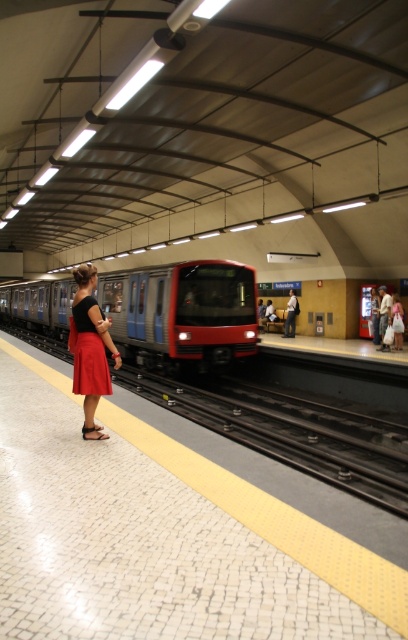
Question: Does white mosaic tile platform at center appear over matte red skirt at left?

Choices:
 (A) no
 (B) yes

Answer: (A)

Question: Considering the real-world distances, which object is farthest from the white mosaic tile platform at center?

Choices:
 (A) matte red skirt at center
 (B) matte red skirt at left

Answer: (B)

Question: Which object is closer to the camera taking this photo?

Choices:
 (A) matte red train at center
 (B) white mosaic tile platform at center
 (C) matte red skirt at left

Answer: (B)

Question: Can you confirm if white mosaic tile platform at center is wider than matte red skirt at left?

Choices:
 (A) no
 (B) yes

Answer: (B)

Question: Which point is farther to the camera?

Choices:
 (A) white mosaic tile platform at center
 (B) matte red train at center

Answer: (B)

Question: Is white mosaic tile platform at center positioned behind matte red skirt at left?

Choices:
 (A) yes
 (B) no

Answer: (B)